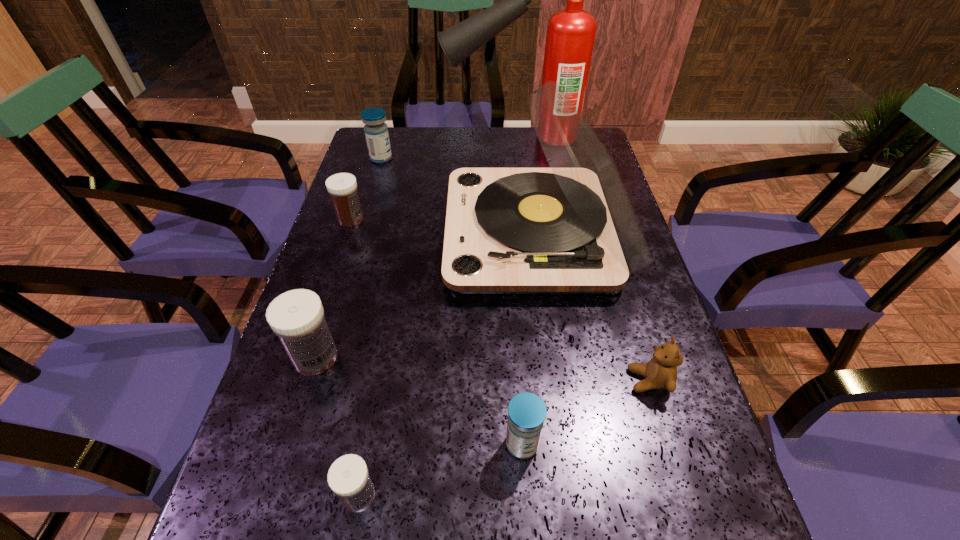
Where is `white medicine that is the second closest to the farthest object`? white medicine that is the second closest to the farthest object is located at coordinates (297, 317).

Select which white medicine appears as the closest to the fourth object from left to right. Please provide its 2D coordinates. Your answer should be formatted as a tuple, i.e. [(x, y)], where the tuple contains the x and y coordinates of a point satisfying the conditions above.

[(297, 317)]

Locate an element on the screen. The image size is (960, 540). vacant space that satisfies the following two spatial constraints: 1. with the tonearm facing the front of the second tallest object; 2. on the front side of the fourth object from left to right is located at coordinates (569, 495).